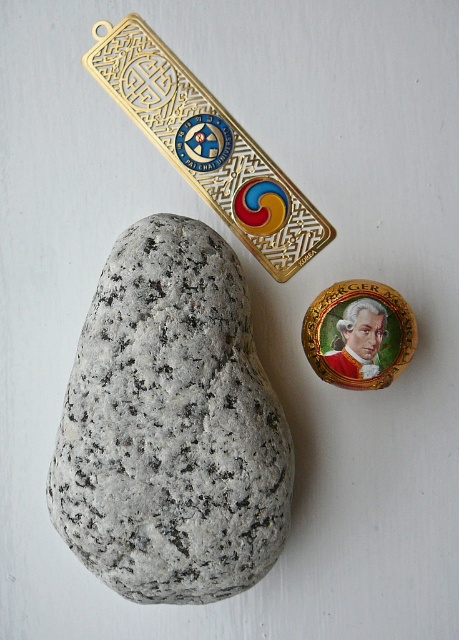
Can you confirm if granite rock at center is smaller than gold metallic badge at upper center?

No.

Locate an element on the screen. This screenshot has height=640, width=459. granite rock at center is located at coordinates (171, 426).

Can you confirm if granite rock at center is wider than gold metallic bookmark at upper center?

Incorrect, granite rock at center's width does not surpass gold metallic bookmark at upper center's.

Is point (224, 444) positioned in front of point (112, 93)?

Yes, point (224, 444) is closer to viewer.

Which is in front, point (76, 419) or point (133, 61)?

Point (76, 419)

This screenshot has height=640, width=459. Identify the location of granite rock at center. (171, 426).

Who is taller, gold metallic bookmark at upper center or gold metallic badge at upper center?

gold metallic bookmark at upper center

Between point (167, 148) and point (326, 316), which one is positioned in front?

Point (326, 316)

The width and height of the screenshot is (459, 640). Identify the location of gold metallic bookmark at upper center. (207, 147).